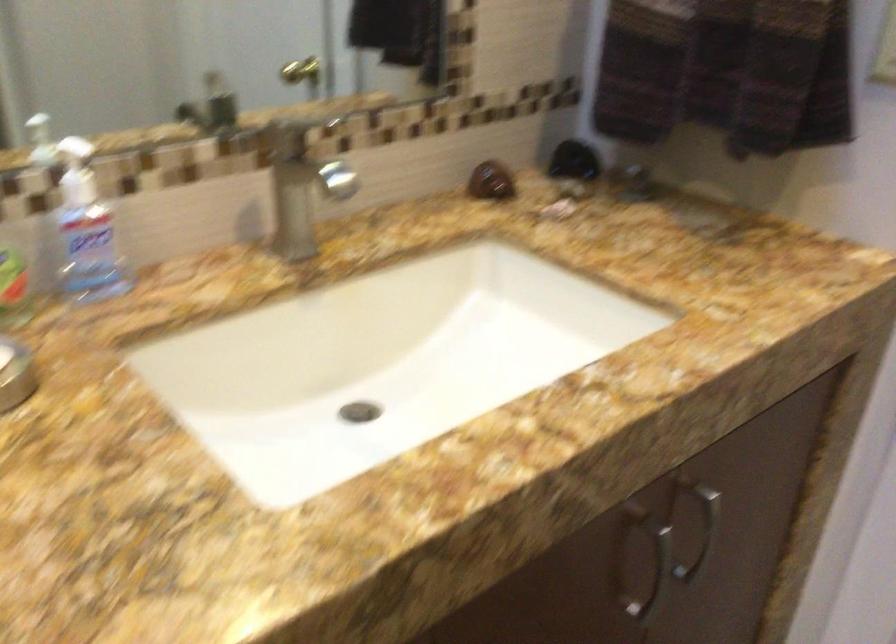
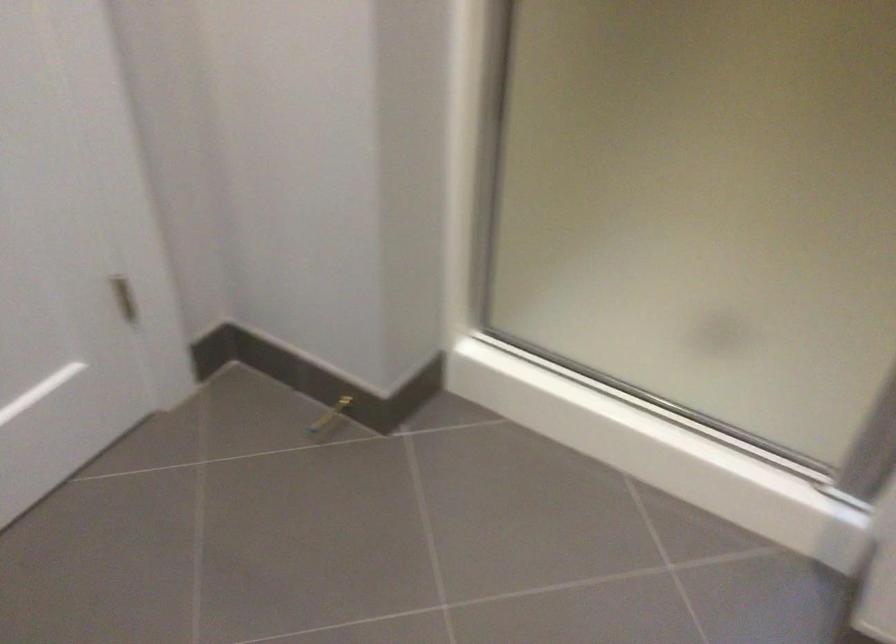
Based on the continuous images, in which direction is the camera rotating?

The rotation direction of the camera is right-down.